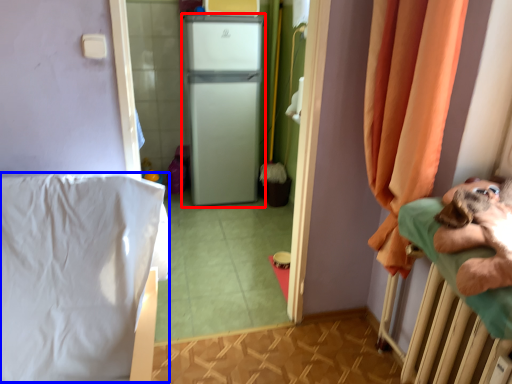
Question: Which object appears closest to the camera in this image, appliance (highlighted by a red box) or sheet (highlighted by a blue box)?

Choices:
 (A) appliance
 (B) sheet

Answer: (B)